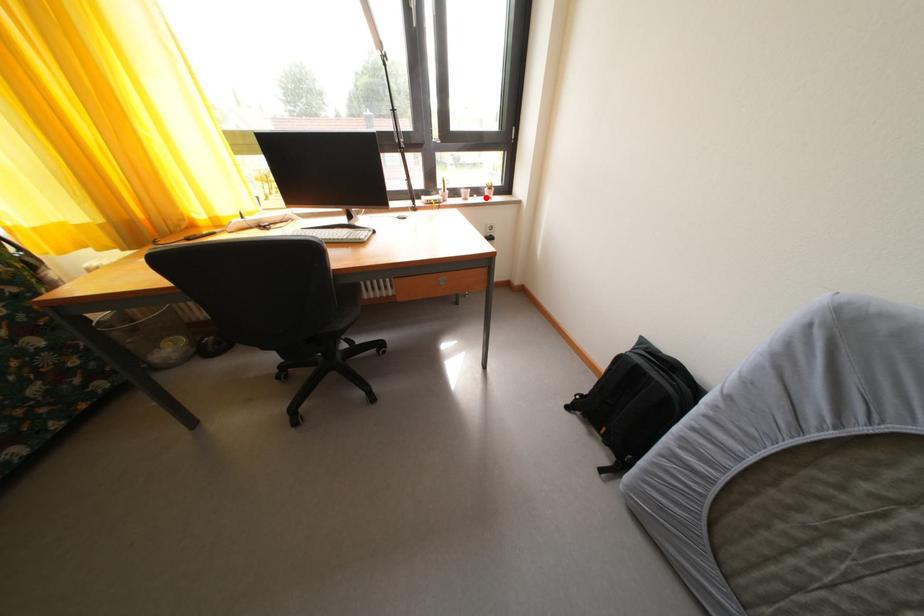
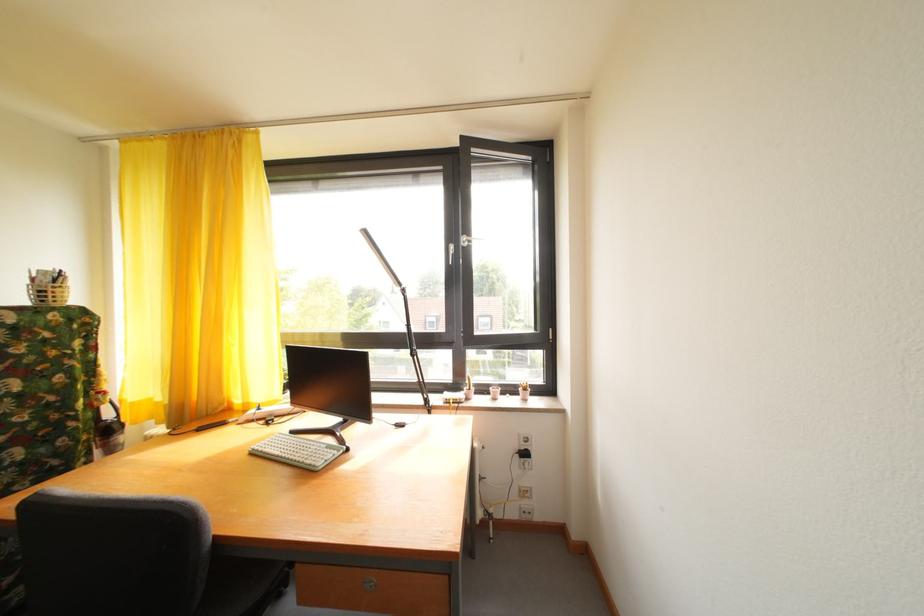
Question: I am providing you with two images of the same scene from different viewpoints. In image1, a red point is highlighted. Considering the same 3D point in image2, which of the following is correct?

Choices:
 (A) It is closer
 (B) It is farther

Answer: (B)